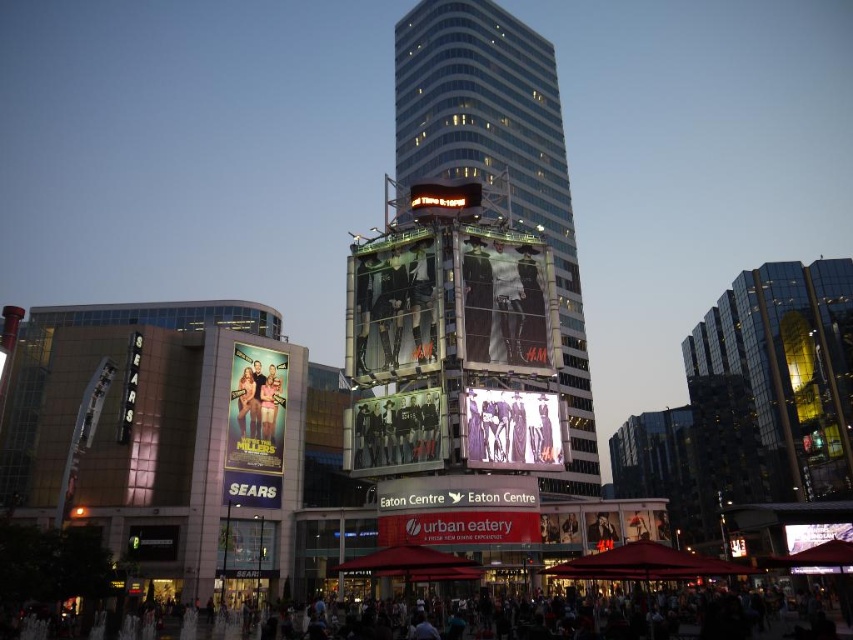
Question: Which of the following is the closest to the observer?

Choices:
 (A) glassy reflective tower at center
 (B) smooth black jacket at center
 (C) metallic silver billboard at center

Answer: (C)

Question: Can you confirm if glassy reflective tower at center is thinner than smooth black jacket at center?

Choices:
 (A) no
 (B) yes

Answer: (A)

Question: Estimate the real-world distances between objects in this image. Which object is closer to the smooth skin figure at center?

Choices:
 (A) metallic gold billboard at center
 (B) matte glass building at left
 (C) metallic silver billboard at center
 (D) glassy reflective tower at center

Answer: (A)

Question: Does red matte signboard at center have a larger size compared to smooth skin figure at center?

Choices:
 (A) yes
 (B) no

Answer: (A)

Question: Can you confirm if glassy reflective tower at center is smaller than metallic gold billboard at center?

Choices:
 (A) no
 (B) yes

Answer: (A)

Question: Which of the following is the closest to the observer?

Choices:
 (A) metallic gold billboard at center
 (B) glassy reflective tower at center
 (C) red matte signboard at center
 (D) matte purple dress at center

Answer: (C)